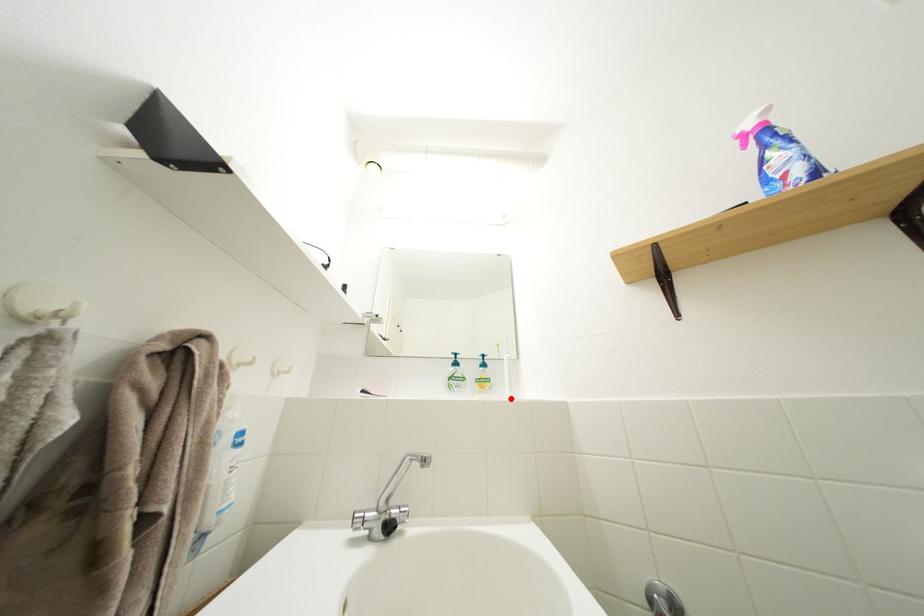
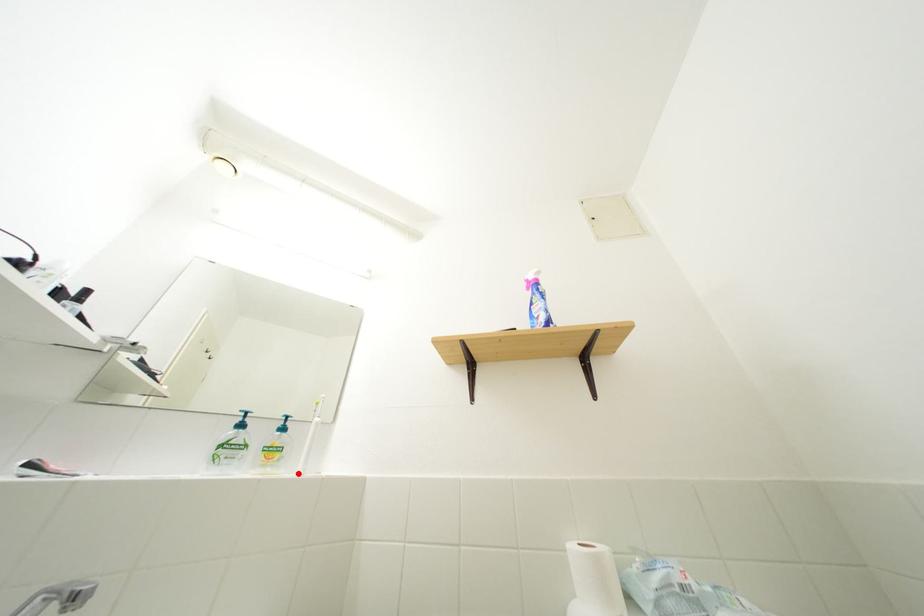
I am providing you with two images of the same scene from different viewpoints. A red point is marked on the first image and another point is marked on the second image. Is the marked point in image1 the same physical position as the marked point in image2?

Yes